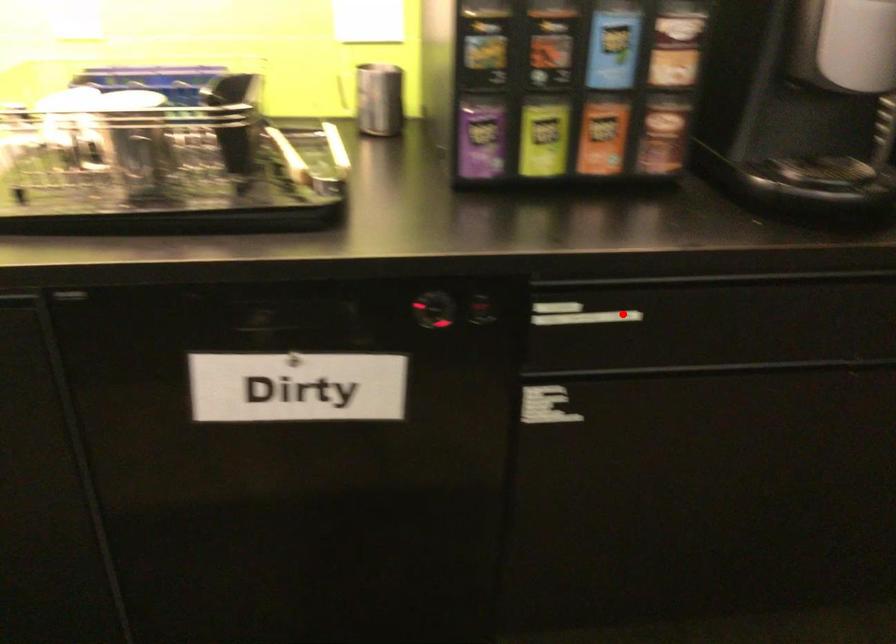
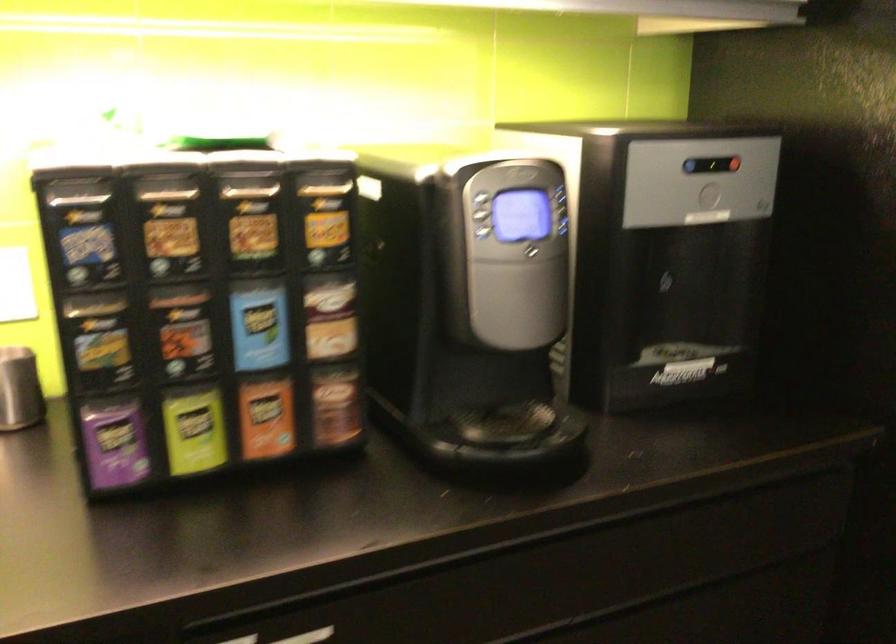
Find the pixel in the second image that matches the highlighted location in the first image.

(308, 636)